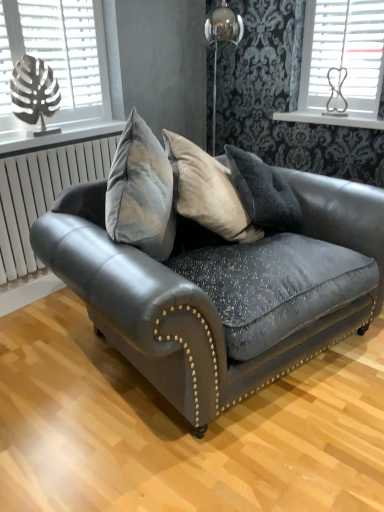
Question: Should I look upward or downward to see velvet dark gray couch at center?

Choices:
 (A) down
 (B) up

Answer: (A)

Question: From a real-world perspective, does metallic leaf at left, the 1th window when ordered from left to right, sit lower than white plastic blinds at upper right, the 2th window positioned from the left?

Choices:
 (A) yes
 (B) no

Answer: (A)

Question: From the image's perspective, would you say metallic leaf at left, the second window positioned from the right, is positioned over white plastic blinds at upper right, the 2th window positioned from the left?

Choices:
 (A) yes
 (B) no

Answer: (B)

Question: Is metallic leaf at left, the 1th window when ordered from left to right, oriented away from white plastic blinds at upper right, marked as the first window in a right-to-left arrangement?

Choices:
 (A) yes
 (B) no

Answer: (B)

Question: Can we say metallic leaf at left, the 1th window when ordered from left to right, lies outside white plastic blinds at upper right, marked as the first window in a right-to-left arrangement?

Choices:
 (A) yes
 (B) no

Answer: (A)

Question: Is metallic leaf at left, the second window positioned from the right, in front of white plastic blinds at upper right, the 2th window positioned from the left?

Choices:
 (A) no
 (B) yes

Answer: (B)

Question: Is metallic leaf at left, the 1th window when ordered from left to right, to the left of white plastic blinds at upper right, marked as the first window in a right-to-left arrangement, from the viewer's perspective?

Choices:
 (A) yes
 (B) no

Answer: (A)

Question: Is white plastic blinds at upper right, the 2th window positioned from the left, completely or partially inside white wooden shelf at upper right?

Choices:
 (A) yes
 (B) no

Answer: (B)

Question: Can you confirm if white wooden shelf at upper right is bigger than white plastic blinds at upper right, the 2th window positioned from the left?

Choices:
 (A) no
 (B) yes

Answer: (B)

Question: Is white wooden shelf at upper right with white plastic blinds at upper right, the 2th window positioned from the left?

Choices:
 (A) yes
 (B) no

Answer: (B)

Question: Is white wooden shelf at upper right at the right side of white plastic blinds at upper right, marked as the first window in a right-to-left arrangement?

Choices:
 (A) yes
 (B) no

Answer: (B)

Question: Is the position of white wooden shelf at upper right more distant than that of white plastic blinds at upper right, the 2th window positioned from the left?

Choices:
 (A) no
 (B) yes

Answer: (B)

Question: From a real-world perspective, does white wooden shelf at upper right sit lower than white plastic blinds at upper right, marked as the first window in a right-to-left arrangement?

Choices:
 (A) no
 (B) yes

Answer: (B)

Question: Can white wooden shelf at upper right be found inside metallic leaf at left, the 1th window when ordered from left to right?

Choices:
 (A) no
 (B) yes

Answer: (A)